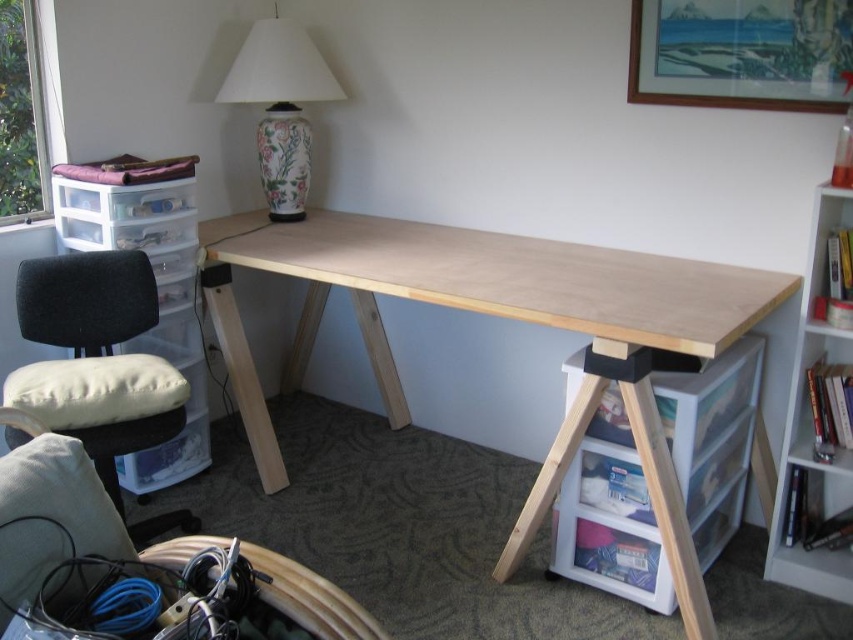
You are setting up a new desk in your home office. You have a natural wood table at center and a white wood bookshelf at right. Which one should you place first if you want to ensure there is enough space for both?

The natural wood table at center is bigger than the white wood bookshelf at right, so you should place the natural wood table at center first to ensure there is enough space for both.

You are moving into this home office and need to place a large printer that requires a surface area of 1.2 square meters. Given the natural wood table at center and the velvet black swivel chair at left, which object can accommodate the printer?

The natural wood table at center is bigger than the velvet black swivel chair at left, so the printer can be placed on the natural wood table at center.

You are setting up a new desk lamp and need to place it on the tallest object in the scene. Which object should you choose between the natural wood table at center and the white wood bookshelf at right?

The natural wood table at center is taller than the white wood bookshelf at right, so you should place the desk lamp on the natural wood table at center.